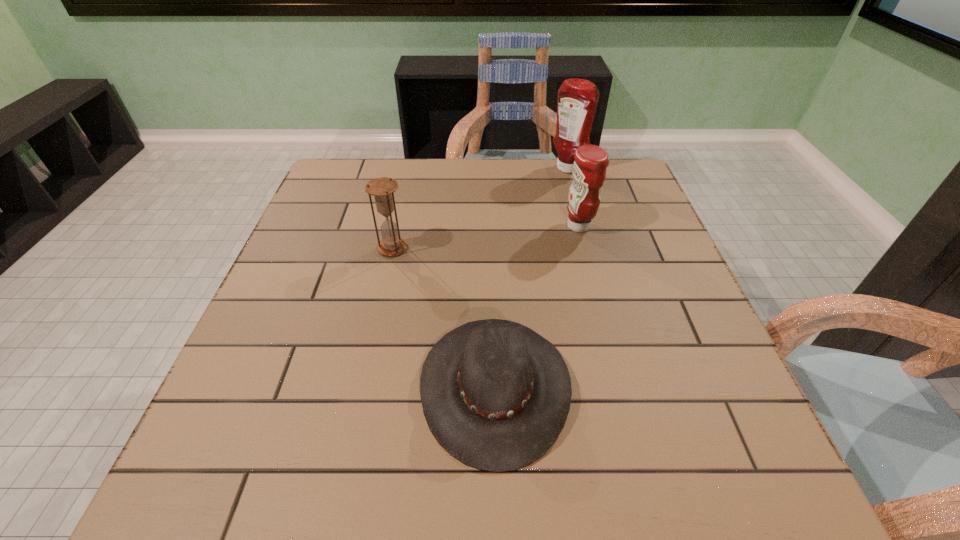
In the image, there is a desktop. Where is `vacant space at the near right corner`? Image resolution: width=960 pixels, height=540 pixels. vacant space at the near right corner is located at coordinates (721, 457).

I want to click on free space between the farthest object and the second shortest object, so click(480, 209).

Where is `unoccupied position between the shorter condiment and the hat`? unoccupied position between the shorter condiment and the hat is located at coordinates [537, 306].

I want to click on free spot between the hourglass and the shorter condiment, so click(x=486, y=237).

Locate an element on the screen. Image resolution: width=960 pixels, height=540 pixels. free point between the hourglass and the nearer condiment is located at coordinates pyautogui.click(x=486, y=237).

You are a GUI agent. You are given a task and a screenshot of the screen. Output one action in this format:
    pyautogui.click(x=<x>, y=<y>)
    Task: Click on the vacant area between the nearest object and the hourglass
    Image resolution: width=960 pixels, height=540 pixels.
    Given the screenshot: What is the action you would take?
    pyautogui.click(x=444, y=318)

At what (x,y) coordinates should I click in order to perform the action: click on empty space that is in between the farther condiment and the second object from left to right. Please return your answer as a coordinate pair (x, y). The height and width of the screenshot is (540, 960). Looking at the image, I should click on (531, 278).

Identify the location of unoccupied area between the nearest object and the shorter condiment. Image resolution: width=960 pixels, height=540 pixels. (537, 306).

In order to click on free spot between the leftmost object and the nearer condiment in this screenshot , I will do `click(486, 237)`.

Locate an element on the screen. The width and height of the screenshot is (960, 540). empty location between the nearer condiment and the leftmost object is located at coordinates click(x=486, y=237).